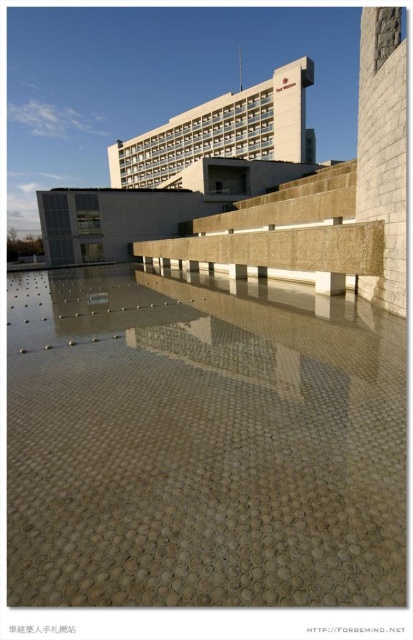
Question: Does translucent glass mosaic at center have a larger size compared to beige stone plaza at upper center?

Choices:
 (A) no
 (B) yes

Answer: (A)

Question: Among these objects, which one is farthest from the camera?

Choices:
 (A) beige stone plaza at upper center
 (B) translucent glass mosaic at center

Answer: (A)

Question: Does translucent glass mosaic at center have a lesser width compared to beige stone plaza at upper center?

Choices:
 (A) yes
 (B) no

Answer: (A)

Question: Which object appears farthest from the camera in this image?

Choices:
 (A) beige stone plaza at upper center
 (B) translucent glass mosaic at center

Answer: (A)

Question: Where is translucent glass mosaic at center located in relation to beige stone plaza at upper center in the image?

Choices:
 (A) above
 (B) below

Answer: (B)

Question: Which object is farther from the camera taking this photo?

Choices:
 (A) beige stone plaza at upper center
 (B) translucent glass mosaic at center

Answer: (A)